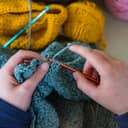
Detect presence of where crocheting is done in the image and mark them. Your answer should be formatted as a list of tuples, i.e. [(x1, y1), (x2, y2), ...], where each tuple contains the x and y coordinates of a point satisfying the conditions above.

[(59, 64)]